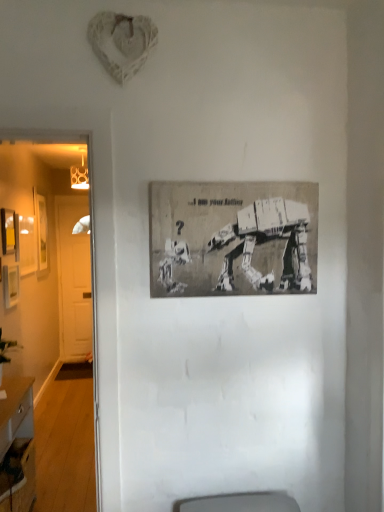
Question: Choose the correct answer: Is wooden desk at lower left inside matte yellow picture frame at left, which ranks as the 3th picture frame in back-to-front order, or outside it?

Choices:
 (A) outside
 (B) inside

Answer: (A)

Question: In the image, is wooden desk at lower left on the left side or the right side of matte yellow picture frame at left, which ranks as the 3th picture frame in back-to-front order?

Choices:
 (A) right
 (B) left

Answer: (A)

Question: Which is farther from the wooden picture frame at left, the first picture frame positioned from the left?

Choices:
 (A) matte yellow picture frame at left, the 2th picture frame from the left
 (B) wooden picture frame at left, which is the third picture frame in left-to-right order
 (C) white wooden door at left
 (D) wooden desk at lower left
 (E) gray paper poster at center, acting as the 1th picture frame starting from the right

Answer: (E)

Question: Which of these objects is positioned farthest from the gray paper poster at center, placed as the first picture frame when sorted from front to back?

Choices:
 (A) white wooden door at left
 (B) wooden desk at lower left
 (C) matte yellow picture frame at left, the 2th picture frame from the left
 (D) wooden picture frame at left, the first picture frame positioned from the left
 (E) wooden picture frame at left, marked as the second picture frame in a back-to-front arrangement

Answer: (A)